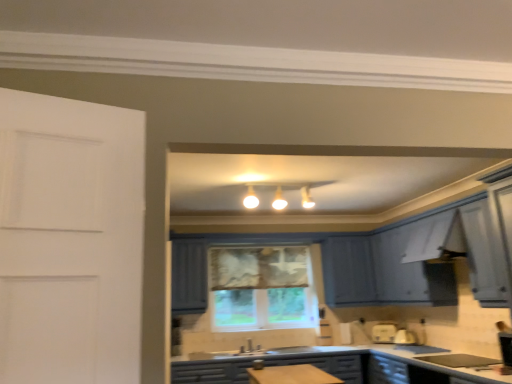
Question: Does matte blue cabinets at center have a lesser width compared to matte white window at center?

Choices:
 (A) yes
 (B) no

Answer: (B)

Question: Is matte blue cabinets at center wider than matte white window at center?

Choices:
 (A) no
 (B) yes

Answer: (B)

Question: Is matte white window at center at the back of matte blue cabinets at center?

Choices:
 (A) no
 (B) yes

Answer: (A)

Question: Considering the relative positions of matte blue cabinets at center and matte white window at center in the image provided, is matte blue cabinets at center in front of matte white window at center?

Choices:
 (A) no
 (B) yes

Answer: (B)

Question: Does matte blue cabinets at center appear on the left side of matte white window at center?

Choices:
 (A) no
 (B) yes

Answer: (A)

Question: Is matte blue cabinets at center touching matte white window at center?

Choices:
 (A) yes
 (B) no

Answer: (B)

Question: Does matte white window at center have a lesser width compared to matte blue cabinets at center?

Choices:
 (A) yes
 (B) no

Answer: (A)

Question: Is matte white window at center facing away from matte blue cabinets at center?

Choices:
 (A) no
 (B) yes

Answer: (A)

Question: Considering the relative sizes of matte white window at center and matte blue cabinets at center in the image provided, is matte white window at center bigger than matte blue cabinets at center?

Choices:
 (A) no
 (B) yes

Answer: (A)

Question: Is matte white window at center outside of matte blue cabinets at center?

Choices:
 (A) no
 (B) yes

Answer: (B)

Question: From a real-world perspective, does matte white window at center stand above matte blue cabinets at center?

Choices:
 (A) yes
 (B) no

Answer: (A)

Question: Could you tell me if matte white window at center is facing matte blue cabinets at center?

Choices:
 (A) no
 (B) yes

Answer: (A)

Question: Is matte blue cabinets at center inside or outside of matte white window at center?

Choices:
 (A) outside
 (B) inside

Answer: (A)